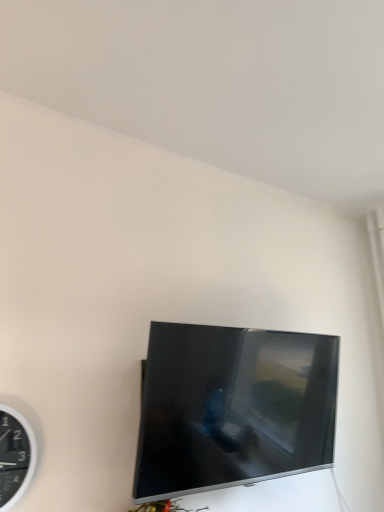
Find the location of `black plastic wall clock at left`. black plastic wall clock at left is located at coordinates (15, 456).

Describe the element at coordinates (15, 456) in the screenshot. I see `black plastic wall clock at left` at that location.

The width and height of the screenshot is (384, 512). Identify the location of satin black tv at center. (233, 408).

In the scene shown: Measure the distance between point [242,348] and camera.

They are 1.20 meters apart.

What do you see at coordinates (233, 408) in the screenshot? I see `satin black tv at center` at bounding box center [233, 408].

Where is `black plastic wall clock at left`? The width and height of the screenshot is (384, 512). black plastic wall clock at left is located at coordinates (15, 456).

Which is more to the left, satin black tv at center or black plastic wall clock at left?

black plastic wall clock at left.

Does satin black tv at center lie in front of black plastic wall clock at left?

No, satin black tv at center is further to the viewer.

Does point (184, 397) come farther from viewer compared to point (32, 472)?

Yes, it is behind point (32, 472).

From the image's perspective, which object appears higher, satin black tv at center or black plastic wall clock at left?

satin black tv at center appears higher in the image.

From a real-world perspective, is satin black tv at center physically below black plastic wall clock at left?

No.

From the picture: Considering the relative sizes of satin black tv at center and black plastic wall clock at left in the image provided, is satin black tv at center thinner than black plastic wall clock at left?

No, satin black tv at center is not thinner than black plastic wall clock at left.

Considering the sizes of satin black tv at center and black plastic wall clock at left in the image, is satin black tv at center taller or shorter than black plastic wall clock at left?

In the image, satin black tv at center appears to be taller than black plastic wall clock at left.

Considering the sizes of objects satin black tv at center and black plastic wall clock at left in the image provided, who is smaller, satin black tv at center or black plastic wall clock at left?

black plastic wall clock at left.

Is satin black tv at center inside the boundaries of black plastic wall clock at left, or outside?

satin black tv at center exists outside the volume of black plastic wall clock at left.

Is satin black tv at center with black plastic wall clock at left?

They are not placed beside each other.

Is satin black tv at center positioned with its back to black plastic wall clock at left?

No, satin black tv at center's orientation is not away from black plastic wall clock at left.

Find the location of a particular element. This screenshot has height=512, width=384. television behind the black plastic wall clock at left is located at coordinates (233, 408).

In the image, is black plastic wall clock at left on the left side or the right side of satin black tv at center?

From the image, it's evident that black plastic wall clock at left is to the left of satin black tv at center.

Does black plastic wall clock at left come behind satin black tv at center?

No, the depth of black plastic wall clock at left is less than that of satin black tv at center.

Does point (36, 447) come closer to viewer compared to point (297, 458)?

Yes.

From the image's perspective, is black plastic wall clock at left over satin black tv at center?

No, from the image's perspective, black plastic wall clock at left is not on top of satin black tv at center.

From the picture: From a real-world perspective, which is physically above, black plastic wall clock at left or satin black tv at center?

In real-world perspective, satin black tv at center is above.

Can you confirm if black plastic wall clock at left is thinner than satin black tv at center?

Indeed, black plastic wall clock at left has a lesser width compared to satin black tv at center.

Considering the sizes of objects black plastic wall clock at left and satin black tv at center in the image provided, who is shorter, black plastic wall clock at left or satin black tv at center?

black plastic wall clock at left.

Between black plastic wall clock at left and satin black tv at center, which one has larger size?

With larger size is satin black tv at center.

Is black plastic wall clock at left situated inside satin black tv at center or outside?

black plastic wall clock at left is located beyond the bounds of satin black tv at center.

Are black plastic wall clock at left and satin black tv at center far apart?

No, black plastic wall clock at left is not far away from satin black tv at center.

Is black plastic wall clock at left positioned with its back to satin black tv at center?

No, satin black tv at center is not at the back of black plastic wall clock at left.

I want to click on wall clock that appears below the satin black tv at center (from a real-world perspective), so click(x=15, y=456).

I want to click on television lying behind the black plastic wall clock at left, so click(233, 408).

The image size is (384, 512). In order to click on television that appears above the black plastic wall clock at left (from a real-world perspective) in this screenshot , I will do `click(233, 408)`.